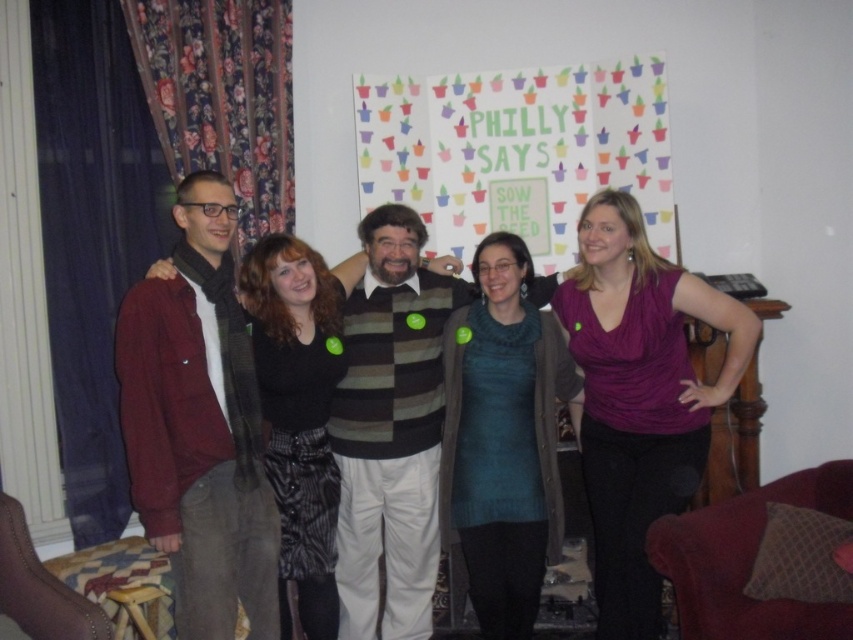
Question: Which of the following is the closest to the observer?

Choices:
 (A) matte black sweater at center
 (B) maroon cotton jacket at left
 (C) black silky blouse at center
 (D) multicolored paper poster at center

Answer: (B)

Question: In this image, where is teal sweater at center located relative to matte black sweater at center?

Choices:
 (A) above
 (B) below

Answer: (A)

Question: Is purple matte tank top at right wider than black silky blouse at center?

Choices:
 (A) no
 (B) yes

Answer: (B)

Question: Which point appears farthest from the camera in this image?

Choices:
 (A) (718, 304)
 (B) (235, 515)
 (C) (486, 547)
 (D) (555, 225)

Answer: (D)

Question: Does matte black sweater at center come in front of black silky blouse at center?

Choices:
 (A) yes
 (B) no

Answer: (A)

Question: Estimate the real-world distances between objects in this image. Which object is closer to the matte black sweater at center?

Choices:
 (A) teal sweater at center
 (B) black silky blouse at center
 (C) maroon cotton jacket at left

Answer: (B)